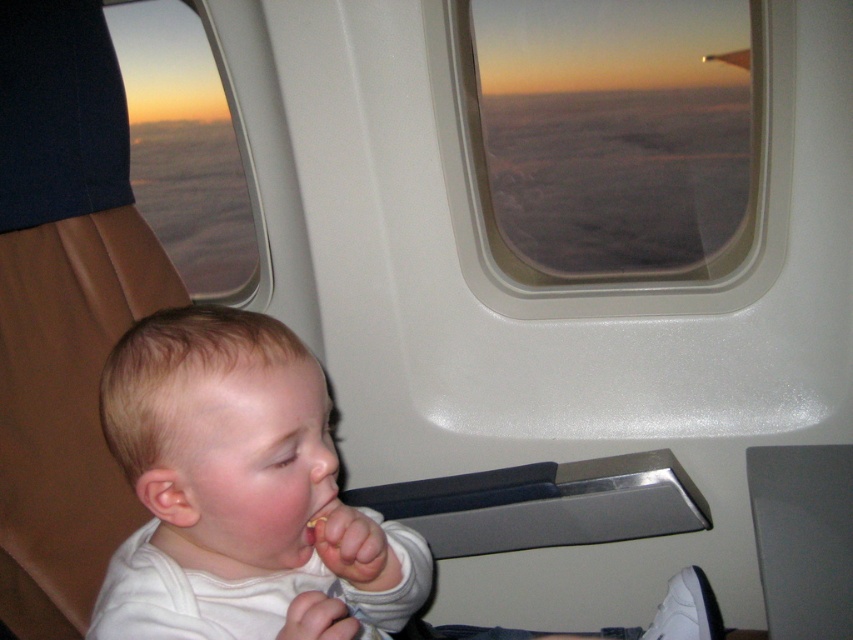
You are a flight attendant checking the cabin. You notice the white matte baby at center and the smooth yellowish flesh at mouth center. Which object is taller?

The white matte baby at center is taller than the smooth yellowish flesh at mouth center.

You are a flight attendant checking the seating arrangement. You need to determine if there is enough space for a small carryon bag between the white matte baby at center and the transparent glass airplane window at upper center. Based on the scene description, can you confirm if there is sufficient space?

The white matte baby at center occupies less space than the transparent glass airplane window at upper center, so there is likely enough space for the small carryon bag between them.